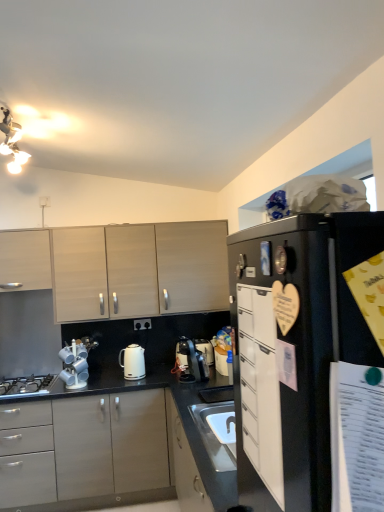
The image size is (384, 512). What are the coordinates of `vacant space positioned to the left of white glossy kettle at center` in the screenshot? It's located at (106, 381).